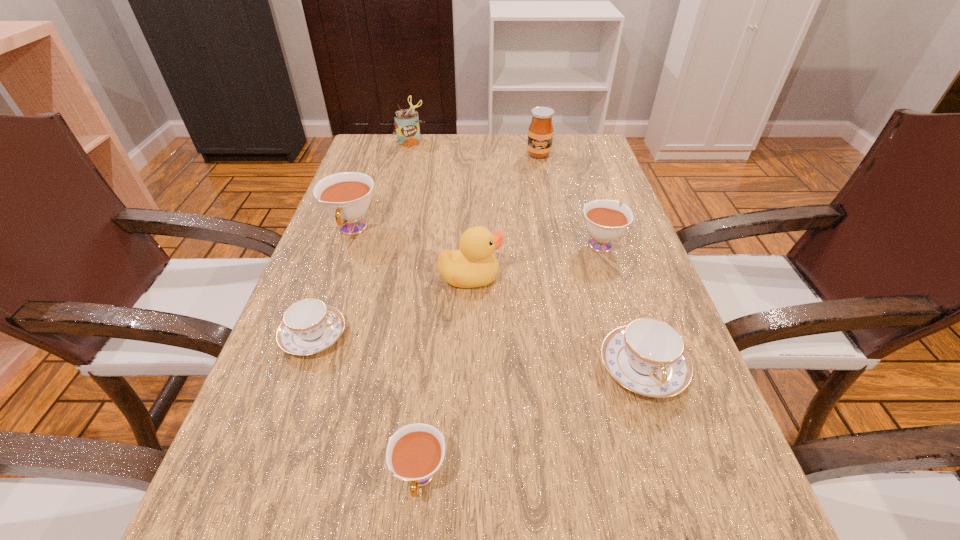
Where is `free space located 0.210m on the side with the handle of the left blue teacup`? free space located 0.210m on the side with the handle of the left blue teacup is located at coordinates (461, 336).

This screenshot has height=540, width=960. I want to click on can that is at the far edge, so click(406, 122).

Where is `honey that is at the far edge`? The height and width of the screenshot is (540, 960). honey that is at the far edge is located at coordinates (540, 133).

The height and width of the screenshot is (540, 960). I want to click on can positioned at the left edge, so click(x=406, y=122).

Identify the location of honey located at the right edge. (540, 133).

Where is `object that is at the far left corner`? The image size is (960, 540). object that is at the far left corner is located at coordinates (406, 122).

At what (x,y) coordinates should I click in order to perform the action: click on object located at the far right corner. Please return your answer as a coordinate pair (x, y). This screenshot has height=540, width=960. Looking at the image, I should click on click(540, 133).

The width and height of the screenshot is (960, 540). Identify the location of vacant space at the far edge of the desktop. (426, 169).

At what (x,y) coordinates should I click in order to perform the action: click on free point at the left edge. Please return your answer as a coordinate pair (x, y). The image size is (960, 540). Looking at the image, I should click on (396, 176).

Image resolution: width=960 pixels, height=540 pixels. In order to click on free space at the right edge of the desktop in this screenshot , I will do `click(703, 399)`.